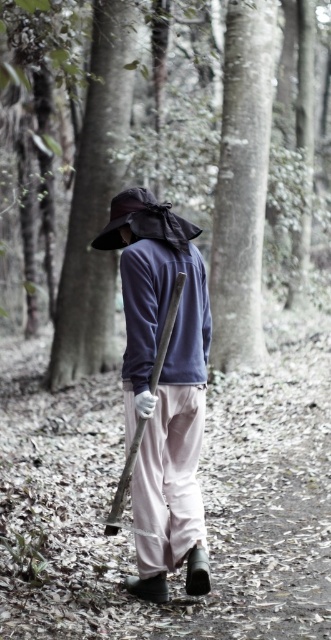
Question: Can you confirm if matte purple shirt at center is positioned above smooth bark tree at upper center?

Choices:
 (A) no
 (B) yes

Answer: (A)

Question: Which point is closer to the camera taking this photo?

Choices:
 (A) (161, 362)
 (B) (249, 160)

Answer: (A)

Question: Does smooth bark tree at upper center have a larger size compared to wooden shovel at center?

Choices:
 (A) yes
 (B) no

Answer: (A)

Question: Is matte black hat at center positioned behind smooth bark tree at upper center?

Choices:
 (A) no
 (B) yes

Answer: (A)

Question: Which point is farther from the camera taking this photo?

Choices:
 (A) (58, 285)
 (B) (110, 296)

Answer: (A)

Question: Which point is closer to the camera?

Choices:
 (A) brown textured tree trunk at center
 (B) matte black hat at center
 (C) wooden shovel at center

Answer: (B)